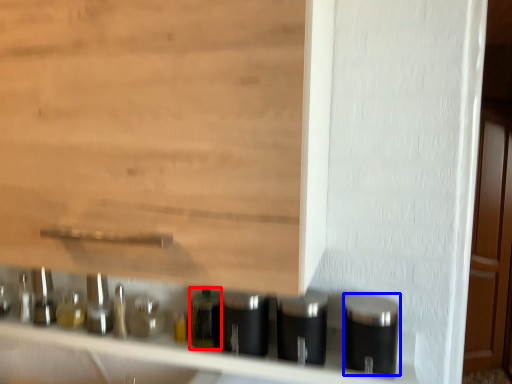
Question: Which of the following is the farthest to the observer, bottle (highlighted by a red box) or silver (highlighted by a blue box)?

Choices:
 (A) bottle
 (B) silver

Answer: (A)